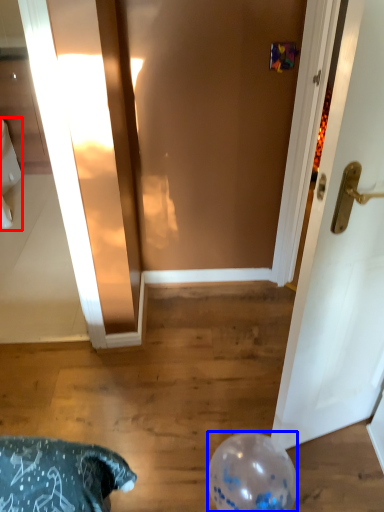
Question: Which object is closer to the camera taking this photo, toilet bowl (highlighted by a red box) or balloon (highlighted by a blue box)?

Choices:
 (A) toilet bowl
 (B) balloon

Answer: (B)